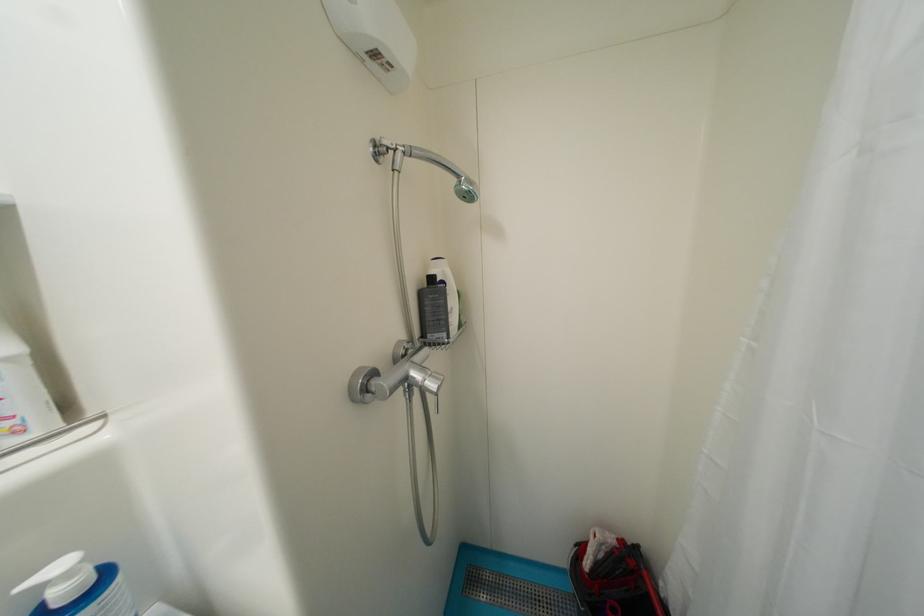
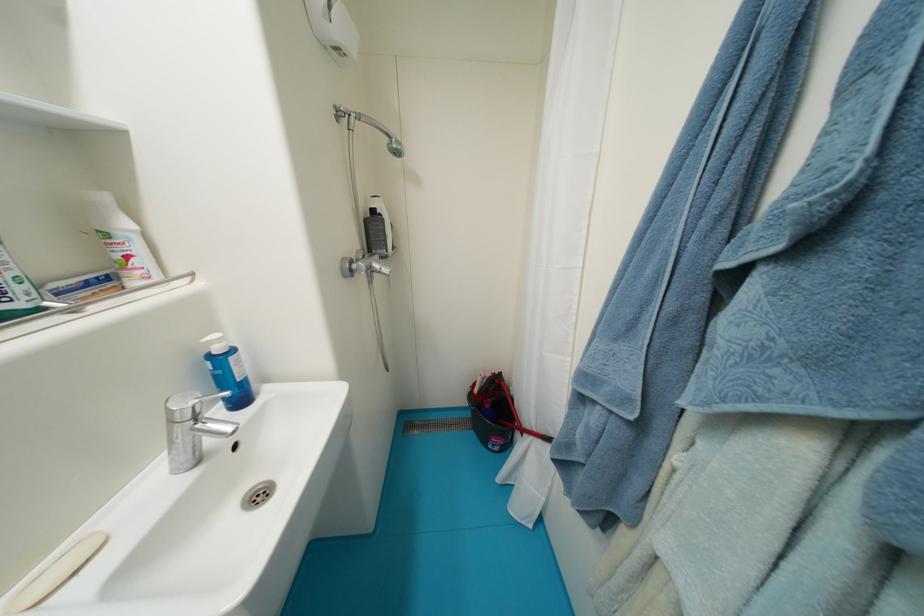
Locate, in the second image, the point that corresponds to pixel 439 281 in the first image.

(380, 214)